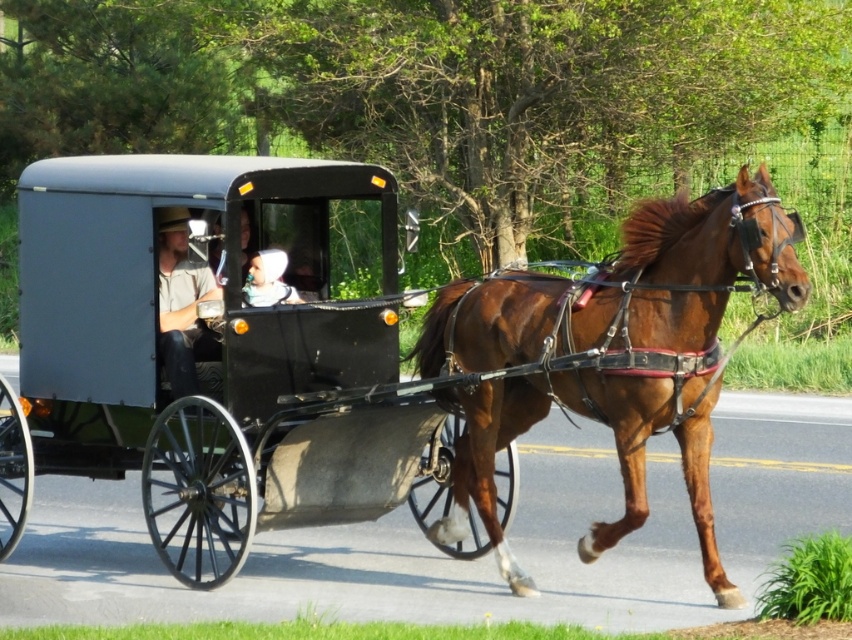
You are a photographer trying to capture the scene of the horse and carriage. You notice two head coverings on the passengers. Which head covering is bigger in size between the matte gray hat at center and the white fabric headscarf at center?

The matte gray hat at center has a larger size compared to the white fabric headscarf at center.

You are a pedestrian standing on the side of the road. You see the matte black horse cart at center and the brown glossy horse at center. Which object is positioned higher from the ground?

The matte black horse cart at center is located above the brown glossy horse at center, so the matte black horse cart at center is higher from the ground.

You are a photographer planning to take a photo of the matte black horse cart at center and the brown glossy horse at center. Which object should you focus on first if you want to capture both in the frame without moving the camera?

The matte black horse cart at center is larger in size than the brown glossy horse at center, so you should focus on the matte black horse cart at center first to ensure it fills the frame appropriately before adjusting for the smaller brown glossy horse at center.